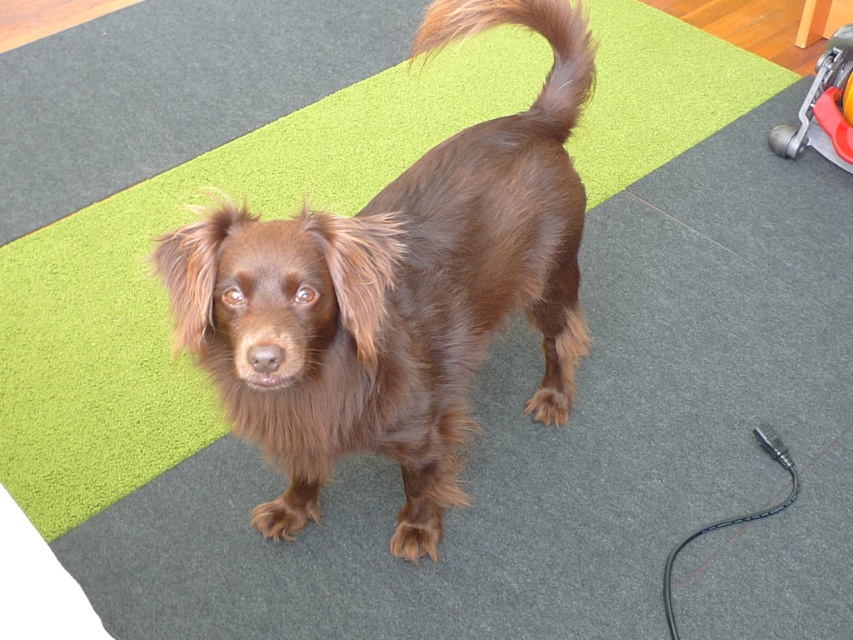
Question: Which point is closer to the camera taking this photo?

Choices:
 (A) (790, 486)
 (B) (569, 40)

Answer: (B)

Question: Which point is closer to the camera?

Choices:
 (A) orange plastic baby carriage at lower right
 (B) brown furry dog at center

Answer: (B)

Question: Which object appears farthest from the camera in this image?

Choices:
 (A) orange plastic baby carriage at lower right
 (B) black rubber leash at lower right

Answer: (A)

Question: Can you confirm if brown furry dog at center is positioned above black rubber leash at lower right?

Choices:
 (A) no
 (B) yes

Answer: (B)

Question: Considering the relative positions of orange plastic baby carriage at lower right and black rubber leash at lower right in the image provided, where is orange plastic baby carriage at lower right located with respect to black rubber leash at lower right?

Choices:
 (A) right
 (B) left

Answer: (A)

Question: Can you confirm if brown furry tail at upper center is wider than orange plastic baby carriage at lower right?

Choices:
 (A) no
 (B) yes

Answer: (B)